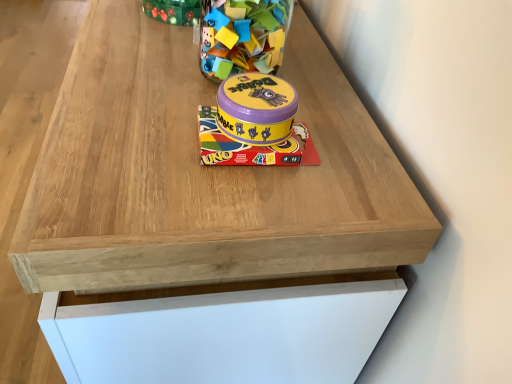
What is the approximate width of translucent plastic container at upper center, the first toy from the back?

translucent plastic container at upper center, the first toy from the back, is 3.58 inches wide.

Image resolution: width=512 pixels, height=384 pixels. What do you see at coordinates (243, 36) in the screenshot?
I see `translucent plastic container at upper center, the 2th toy from the front` at bounding box center [243, 36].

Measure the distance between point (267, 40) and camera.

Answer: The distance of point (267, 40) from camera is 23.23 inches.

Find the location of a particular element. translucent plastic container at upper center, which appears as the first toy when viewed from the top is located at coordinates (x=243, y=36).

Identify the location of matte purple tin at center, placed as the 1th toy when sorted from bottom to top. This screenshot has height=384, width=512. (255, 124).

The image size is (512, 384). Describe the element at coordinates (255, 124) in the screenshot. I see `matte purple tin at center, placed as the 1th toy when sorted from bottom to top` at that location.

This screenshot has width=512, height=384. In order to click on translucent plastic container at upper center, the second toy in the bottom-to-top sequence in this screenshot , I will do `click(243, 36)`.

Which is more to the right, matte purple tin at center, the 2th toy in the back-to-front sequence, or translucent plastic container at upper center, the 2th toy from the front?

translucent plastic container at upper center, the 2th toy from the front.

Is matte purple tin at center, which appears as the 1th toy when viewed from the front, further to camera compared to translucent plastic container at upper center, the second toy in the bottom-to-top sequence?

No.

Which is behind, point (290, 140) or point (269, 4)?

Point (269, 4)

From the picture: From the image's perspective, is matte purple tin at center, the 2th toy in the back-to-front sequence, above or below translucent plastic container at upper center, the first toy from the back?

Based on their image positions, matte purple tin at center, the 2th toy in the back-to-front sequence, is located beneath translucent plastic container at upper center, the first toy from the back.

From a real-world perspective, which object rests below the other?

matte purple tin at center, the 2th toy in the back-to-front sequence, is physically lower.

Consider the image. Which of these two, matte purple tin at center, the 2th toy in the back-to-front sequence, or translucent plastic container at upper center, the 2th toy from the front, is wider?

With larger width is matte purple tin at center, the 2th toy in the back-to-front sequence.

Does matte purple tin at center, the second toy in the top-to-bottom sequence, have a lesser height compared to translucent plastic container at upper center, which appears as the first toy when viewed from the top?

Yes.

Who is bigger, matte purple tin at center, placed as the 1th toy when sorted from bottom to top, or translucent plastic container at upper center, the 2th toy from the front?

translucent plastic container at upper center, the 2th toy from the front.

Is matte purple tin at center, the second toy in the top-to-bottom sequence, not inside translucent plastic container at upper center, the second toy in the bottom-to-top sequence?

matte purple tin at center, the second toy in the top-to-bottom sequence, is positioned outside translucent plastic container at upper center, the second toy in the bottom-to-top sequence.

Is matte purple tin at center, placed as the 1th toy when sorted from bottom to top, beside translucent plastic container at upper center, the second toy in the bottom-to-top sequence?

No.

Is matte purple tin at center, placed as the 1th toy when sorted from bottom to top, oriented away from translucent plastic container at upper center, the first toy from the back?

No, matte purple tin at center, placed as the 1th toy when sorted from bottom to top,'s orientation is not away from translucent plastic container at upper center, the first toy from the back.

What's the angular difference between matte purple tin at center, the second toy in the top-to-bottom sequence, and translucent plastic container at upper center, the 2th toy from the front,'s facing directions?

30.7 degrees.

Measure the distance between matte purple tin at center, which appears as the 1th toy when viewed from the front, and translucent plastic container at upper center, the second toy in the bottom-to-top sequence.

matte purple tin at center, which appears as the 1th toy when viewed from the front, and translucent plastic container at upper center, the second toy in the bottom-to-top sequence, are 11.27 centimeters apart.

Where is `toy behind the matte purple tin at center, the 2th toy in the back-to-front sequence`? Image resolution: width=512 pixels, height=384 pixels. toy behind the matte purple tin at center, the 2th toy in the back-to-front sequence is located at coordinates (243, 36).

Which object is positioned more to the left, translucent plastic container at upper center, the 2th toy from the front, or matte purple tin at center, which appears as the 1th toy when viewed from the front?

matte purple tin at center, which appears as the 1th toy when viewed from the front.

Who is more distant, translucent plastic container at upper center, the first toy from the back, or matte purple tin at center, which appears as the 1th toy when viewed from the front?

translucent plastic container at upper center, the first toy from the back.

Is point (239, 21) less distant than point (269, 132)?

No.

From the image's perspective, between translucent plastic container at upper center, the 2th toy from the front, and matte purple tin at center, placed as the 1th toy when sorted from bottom to top, who is located below?

matte purple tin at center, placed as the 1th toy when sorted from bottom to top.

From a real-world perspective, which is physically above, translucent plastic container at upper center, which appears as the first toy when viewed from the top, or matte purple tin at center, which appears as the 1th toy when viewed from the front?

translucent plastic container at upper center, which appears as the first toy when viewed from the top, is physically above.

Considering the relative sizes of translucent plastic container at upper center, the first toy from the back, and matte purple tin at center, the 2th toy in the back-to-front sequence, in the image provided, is translucent plastic container at upper center, the first toy from the back, wider than matte purple tin at center, the 2th toy in the back-to-front sequence,?

No, translucent plastic container at upper center, the first toy from the back, is not wider than matte purple tin at center, the 2th toy in the back-to-front sequence.

In terms of height, does translucent plastic container at upper center, the 2th toy from the front, look taller or shorter compared to matte purple tin at center, the second toy in the top-to-bottom sequence?

Result: Considering their sizes, translucent plastic container at upper center, the 2th toy from the front, has more height than matte purple tin at center, the second toy in the top-to-bottom sequence.

Who is smaller, translucent plastic container at upper center, the first toy from the back, or matte purple tin at center, the 2th toy in the back-to-front sequence?

Smaller between the two is matte purple tin at center, the 2th toy in the back-to-front sequence.

Is translucent plastic container at upper center, the first toy from the back, located outside matte purple tin at center, the 2th toy in the back-to-front sequence?

That's correct, translucent plastic container at upper center, the first toy from the back, is outside of matte purple tin at center, the 2th toy in the back-to-front sequence.

Looking at this image, is the surface of translucent plastic container at upper center, the first toy from the back, in direct contact with matte purple tin at center, the 2th toy in the back-to-front sequence?

No, translucent plastic container at upper center, the first toy from the back, is not making contact with matte purple tin at center, the 2th toy in the back-to-front sequence.

Is matte purple tin at center, the 2th toy in the back-to-front sequence, at the back of translucent plastic container at upper center, the first toy from the back?

No, translucent plastic container at upper center, the first toy from the back, is not facing away from matte purple tin at center, the 2th toy in the back-to-front sequence.

Measure the distance between translucent plastic container at upper center, the first toy from the back, and matte purple tin at center, placed as the 1th toy when sorted from bottom to top.

4.44 inches.

You are a GUI agent. You are given a task and a screenshot of the screen. Output one action in this format:
    pyautogui.click(x=<x>, y=<y>)
    Task: Click on the toy that appears below the translucent plastic container at upper center, the first toy from the back (from a real-world perspective)
    This screenshot has width=512, height=384.
    Given the screenshot: What is the action you would take?
    pyautogui.click(x=255, y=124)

This screenshot has width=512, height=384. What are the coordinates of `toy below the translucent plastic container at upper center, the 2th toy from the front (from a real-world perspective)` in the screenshot? It's located at (255, 124).

Where is `toy above the matte purple tin at center, which appears as the 1th toy when viewed from the front (from a real-world perspective)`? This screenshot has width=512, height=384. toy above the matte purple tin at center, which appears as the 1th toy when viewed from the front (from a real-world perspective) is located at coordinates (243, 36).